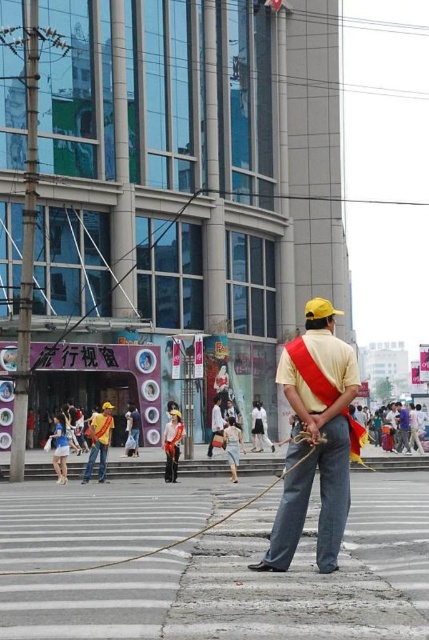
Does yellow matte/solid hat at center come in front of brown rough rope at center?

No, it is behind brown rough rope at center.

Who is higher up, yellow matte/solid hat at center or brown rough rope at center?

yellow matte/solid hat at center is higher up.

Is point (329, 353) behind point (96, 566)?

That is True.

Where is `yellow matte/solid hat at center`? The height and width of the screenshot is (640, 429). yellow matte/solid hat at center is located at coordinates (316, 436).